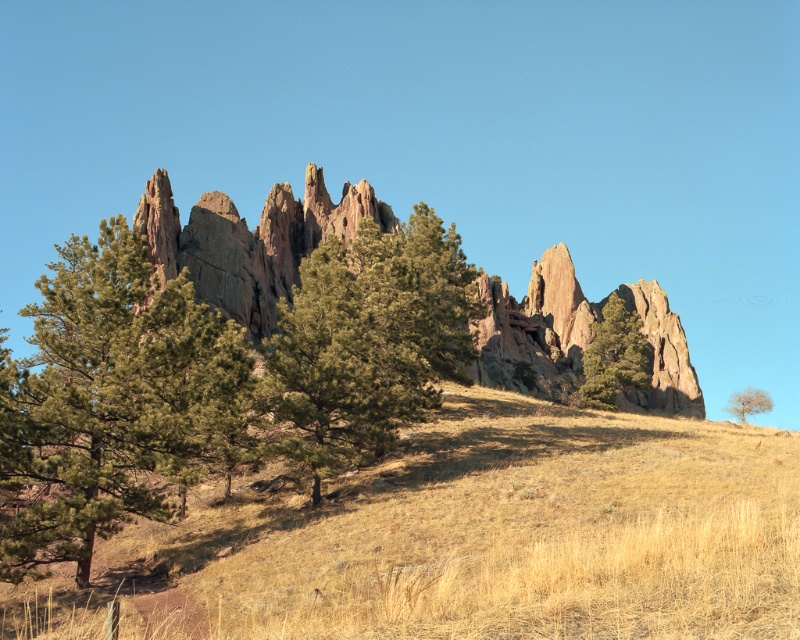
You are standing on the hill and want to walk towards the pine tree. Which direction should you head to reach the green textured pine tree at left from the dry grass at center?

The dry grass at center is positioned on the right side of green textured pine tree at left, so you should head to the left to reach the green textured pine tree at left from the dry grass at center.

You are a hiker standing at the base of the hill with dry grass at center and green matte tree at center in view. Which object is closer to you as you look towards the hill?

The dry grass at center is closer to you since it has a smaller size compared to the green matte tree at center, indicating it is nearer in the foreground.